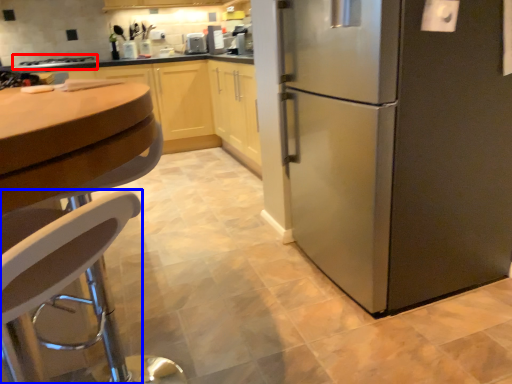
Question: Among these objects, which one is nearest to the camera, stove (highlighted by a red box) or chair (highlighted by a blue box)?

Choices:
 (A) stove
 (B) chair

Answer: (B)